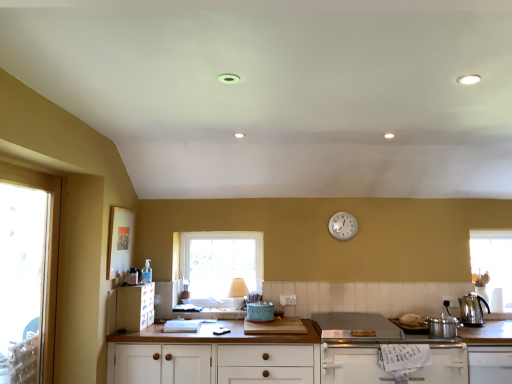
At what (x,y) coordinates should I click in order to perform the action: click on blank space situated above transparent glass window at left, which is the 1th window in front-to-back order (from a real-world perspective). Please return your answer as a coordinate pair (x, y). Image resolution: width=512 pixels, height=384 pixels. Looking at the image, I should click on (38, 169).